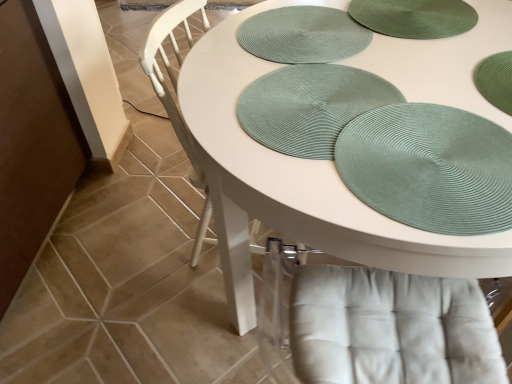
What do you see at coordinates (297, 185) in the screenshot?
I see `white matte table at center` at bounding box center [297, 185].

Image resolution: width=512 pixels, height=384 pixels. Find the location of `green woven placemat at center, the 2th platter positioned from the back`. green woven placemat at center, the 2th platter positioned from the back is located at coordinates (310, 106).

What do you see at coordinates (176, 92) in the screenshot?
I see `white textured chair at center` at bounding box center [176, 92].

What do you see at coordinates (303, 35) in the screenshot? The height and width of the screenshot is (384, 512). I see `green textured placemat at upper center, placed as the 1th platter when sorted from back to front` at bounding box center [303, 35].

Consider the image. How much space does green textured placemat at upper center, placed as the 1th platter when sorted from back to front, occupy horizontally?

It is 15.00 inches.

This screenshot has height=384, width=512. In order to click on green textured placemat at upper right in this screenshot , I will do `click(429, 168)`.

Locate an element on the screen. white matte table at center is located at coordinates (297, 185).

Considering the sizes of objects green textured placemat at upper center, placed as the 1th platter when sorted from back to front, and green textured placemat at upper right in the image provided, who is thinner, green textured placemat at upper center, placed as the 1th platter when sorted from back to front, or green textured placemat at upper right?

green textured placemat at upper right.

Is green textured placemat at upper center, placed as the 1th platter when sorted from back to front, inside or outside of green textured placemat at upper right?

The correct answer is: outside.

Can you confirm if green textured placemat at upper center, which ranks as the 2th platter in front-to-back order, is positioned to the right of green textured placemat at upper right?

Incorrect, green textured placemat at upper center, which ranks as the 2th platter in front-to-back order, is not on the right side of green textured placemat at upper right.

Is green textured placemat at upper center, placed as the 1th platter when sorted from back to front, taller than green textured placemat at upper right?

No, green textured placemat at upper center, placed as the 1th platter when sorted from back to front, is not taller than green textured placemat at upper right.

Which is closer, [293,155] or [238,31]?

Point [293,155] appears to be closer to the viewer than point [238,31].

Which object is closer to the camera, green woven placemat at center, placed as the first platter when sorted from front to back, or green textured placemat at upper center, which ranks as the 2th platter in front-to-back order?

green woven placemat at center, placed as the first platter when sorted from front to back, is more forward.

From the image's perspective, is green woven placemat at center, placed as the first platter when sorted from front to back, above green textured placemat at upper center, which ranks as the 2th platter in front-to-back order?

No, from the image's perspective, green woven placemat at center, placed as the first platter when sorted from front to back, is not above green textured placemat at upper center, which ranks as the 2th platter in front-to-back order.

Is green woven placemat at center, placed as the first platter when sorted from front to back, aimed at green textured placemat at upper center, placed as the 1th platter when sorted from back to front?

No, green woven placemat at center, placed as the first platter when sorted from front to back, is not turned towards green textured placemat at upper center, placed as the 1th platter when sorted from back to front.

From a real-world perspective, is green textured placemat at upper right positioned over white matte table at center based on gravity?

Yes, from a real-world perspective, green textured placemat at upper right is over white matte table at center

Is green textured placemat at upper right taller than white matte table at center?

In fact, green textured placemat at upper right may be shorter than white matte table at center.

Does point (505, 200) come closer to viewer compared to point (217, 62)?

Yes, it is.

From a real-world perspective, between white textured chair at center and green woven placemat at center, the 2th platter positioned from the back, who is vertically higher?

green woven placemat at center, the 2th platter positioned from the back, is physically above.

Which of these two, white textured chair at center or green woven placemat at center, placed as the first platter when sorted from front to back, is smaller?

With smaller size is green woven placemat at center, placed as the first platter when sorted from front to back.

Is green woven placemat at center, the 2th platter positioned from the back, a part of white textured chair at center?

Yes, white textured chair at center is surrounding green woven placemat at center, the 2th platter positioned from the back.

From the picture: Considering the relative sizes of white textured chair at center and green woven placemat at center, the 2th platter positioned from the back, in the image provided, is white textured chair at center shorter than green woven placemat at center, the 2th platter positioned from the back,?

Incorrect, the height of white textured chair at center does not fall short of that of green woven placemat at center, the 2th platter positioned from the back.

Is white textured chair at center with white matte table at center?

No.

Locate an element on the screen. Image resolution: width=512 pixels, height=384 pixels. table on the right of white textured chair at center is located at coordinates (297, 185).

Considering the relative positions of white textured chair at center and white matte table at center in the image provided, is white textured chair at center to the left of white matte table at center from the viewer's perspective?

Indeed, white textured chair at center is positioned on the left side of white matte table at center.

Does green woven placemat at center, placed as the first platter when sorted from front to back, turn towards white textured chair at center?

Yes.

Between point (335, 140) and point (159, 91), which one is positioned in front?

The point (335, 140) is closer.

From a real-world perspective, is green woven placemat at center, placed as the first platter when sorted from front to back, physically below white textured chair at center?

No, from a real-world perspective, green woven placemat at center, placed as the first platter when sorted from front to back, is not beneath white textured chair at center.

Can you confirm if green woven placemat at center, the 2th platter positioned from the back, is wider than white textured chair at center?

In fact, green woven placemat at center, the 2th platter positioned from the back, might be narrower than white textured chair at center.

Which is behind, green textured placemat at upper center, placed as the 1th platter when sorted from back to front, or white textured chair at center?

Positioned behind is green textured placemat at upper center, placed as the 1th platter when sorted from back to front.

Which is behind, point (321, 27) or point (177, 8)?

Point (321, 27)

Can you confirm if green textured placemat at upper center, placed as the 1th platter when sorted from back to front, is wider than white textured chair at center?

Incorrect, the width of green textured placemat at upper center, placed as the 1th platter when sorted from back to front, does not surpass that of white textured chair at center.

From a real-world perspective, is green textured placemat at upper center, placed as the 1th platter when sorted from back to front, on top of white textured chair at center?

Yes.

From a real-world perspective, starting from the green textured placemat at upper right, which platter is the 2nd one below it? Please provide its 2D coordinates.

[(303, 35)]

Identify the location of platter located on the right of green textured placemat at upper center, which ranks as the 2th platter in front-to-back order. Image resolution: width=512 pixels, height=384 pixels. (310, 106).

Which object lies further to the anchor point white textured chair at center, green textured placemat at upper center, which ranks as the 2th platter in front-to-back order, or green textured placemat at upper right?

green textured placemat at upper right is positioned further to the anchor white textured chair at center.

Considering their positions, is white matte table at center positioned closer to green woven placemat at center, placed as the first platter when sorted from front to back, than white textured chair at center?

white matte table at center is positioned closer to the anchor green woven placemat at center, placed as the first platter when sorted from front to back.

Considering their positions, is white textured chair at center positioned closer to white matte table at center than green textured placemat at upper center, placed as the 1th platter when sorted from back to front?

green textured placemat at upper center, placed as the 1th platter when sorted from back to front.

From the picture: Estimate the real-world distances between objects in this image. Which object is further from white textured chair at center, green woven placemat at center, the 2th platter positioned from the back, or green textured placemat at upper right?

green textured placemat at upper right is further to white textured chair at center.

When comparing their distances from green textured placemat at upper center, placed as the 1th platter when sorted from back to front, does green textured placemat at upper right or white textured chair at center seem closer?

The object closer to green textured placemat at upper center, placed as the 1th platter when sorted from back to front, is white textured chair at center.

From the image, which object appears to be farther from green textured placemat at upper center, which ranks as the 2th platter in front-to-back order, white textured chair at center or green textured placemat at upper right?

Based on the image, green textured placemat at upper right appears to be further to green textured placemat at upper center, which ranks as the 2th platter in front-to-back order.

Which object lies further to the anchor point green woven placemat at center, the 2th platter positioned from the back, green textured placemat at upper right or green textured placemat at upper center, placed as the 1th platter when sorted from back to front?

The object further to green woven placemat at center, the 2th platter positioned from the back, is green textured placemat at upper center, placed as the 1th platter when sorted from back to front.

Which object lies further to the anchor point green textured placemat at upper center, which ranks as the 2th platter in front-to-back order, green woven placemat at center, placed as the first platter when sorted from front to back, or green textured placemat at upper right?

Based on the image, green textured placemat at upper right appears to be further to green textured placemat at upper center, which ranks as the 2th platter in front-to-back order.

Where is `chair located between white matte table at center and green textured placemat at upper center, placed as the 1th platter when sorted from back to front, in the depth direction`? The height and width of the screenshot is (384, 512). chair located between white matte table at center and green textured placemat at upper center, placed as the 1th platter when sorted from back to front, in the depth direction is located at coordinates (176, 92).

The image size is (512, 384). Find the location of `chair between green textured placemat at upper center, which ranks as the 2th platter in front-to-back order, and green textured placemat at upper right from top to bottom`. chair between green textured placemat at upper center, which ranks as the 2th platter in front-to-back order, and green textured placemat at upper right from top to bottom is located at coordinates (176, 92).

This screenshot has width=512, height=384. What are the coordinates of `platter positioned between white matte table at center and green textured placemat at upper center, placed as the 1th platter when sorted from back to front, from near to far` in the screenshot? It's located at (310, 106).

Image resolution: width=512 pixels, height=384 pixels. In order to click on glass plate between white matte table at center and green textured placemat at upper center, which ranks as the 2th platter in front-to-back order, in the front-back direction in this screenshot , I will do `click(429, 168)`.